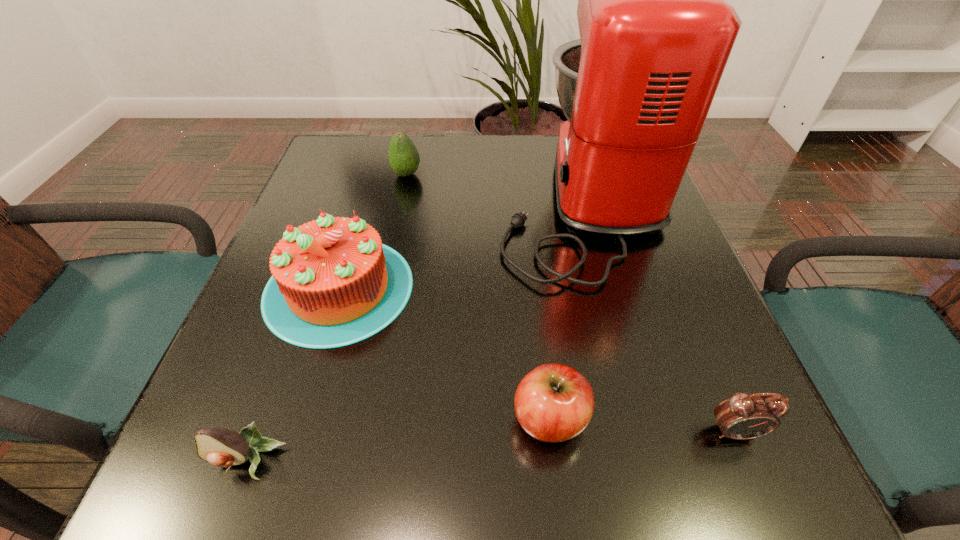
Where is `vacant space that satisfies the following two spatial constraints: 1. on the front-facing side of the kitchen mixer; 2. on the seed side of the left avocado`? vacant space that satisfies the following two spatial constraints: 1. on the front-facing side of the kitchen mixer; 2. on the seed side of the left avocado is located at coordinates (648, 461).

Where is `vacant space that satisfies the following two spatial constraints: 1. on the front-facing side of the kitchen mixer; 2. on the front side of the apple`? This screenshot has width=960, height=540. vacant space that satisfies the following two spatial constraints: 1. on the front-facing side of the kitchen mixer; 2. on the front side of the apple is located at coordinates (637, 418).